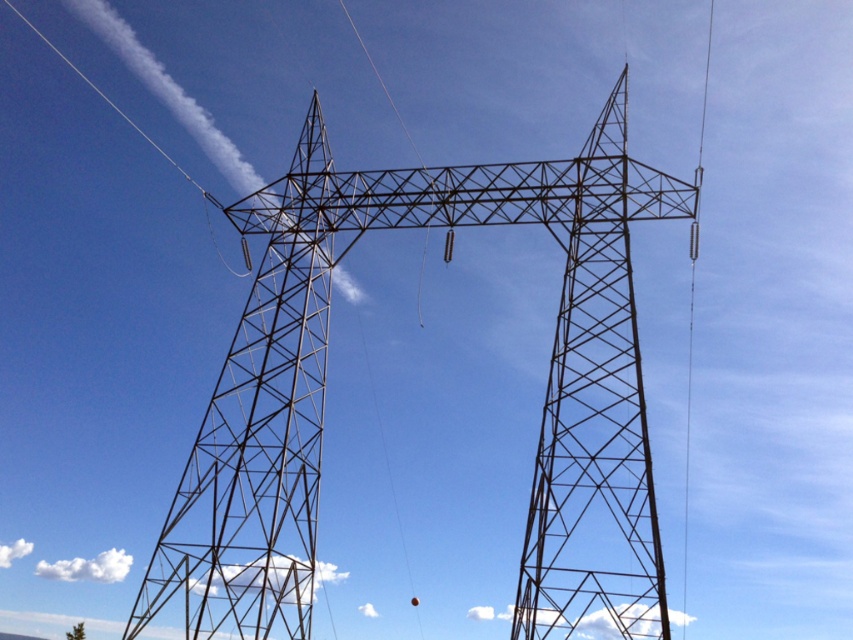
In the scene shown: You are a drone operator trying to navigate between two points in the image of the towers. The points are labeled as point [578,358] and point [215,486]. Which point is positioned closer to you, the observer?

Point [578,358] is closer to the viewer than point [215,486].

You are a maintenance worker inspecting the towers. You notice the metallic structure at left and the metallic wire at right. Which one would block your view of the other when standing between them?

The metallic structure at left is in front of the metallic wire at right, so it would block your view of the metallic wire at right.